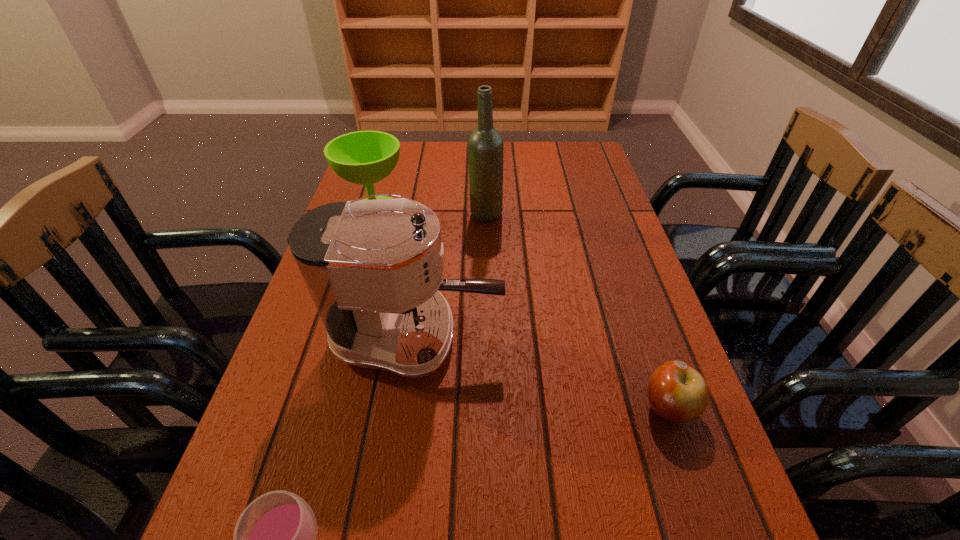
Identify the location of wineglass that is at the left edge. This screenshot has height=540, width=960. (364, 157).

Identify the location of object that is positioned at the right edge. The image size is (960, 540). (677, 392).

Where is `vacant space at the far edge of the desktop`? The image size is (960, 540). vacant space at the far edge of the desktop is located at coordinates (457, 147).

I want to click on vacant space at the left edge of the desktop, so click(294, 442).

Image resolution: width=960 pixels, height=540 pixels. I want to click on vacant space at the right edge of the desktop, so click(x=711, y=443).

This screenshot has width=960, height=540. Find the location of `vacant region between the wine bottle and the coffee maker`. vacant region between the wine bottle and the coffee maker is located at coordinates (450, 276).

This screenshot has width=960, height=540. What are the coordinates of `vacant point located between the wine bottle and the shortest object` in the screenshot? It's located at (577, 311).

Find the location of a particular element. The height and width of the screenshot is (540, 960). vacant region between the coffee maker and the wine bottle is located at coordinates (450, 276).

Locate an element on the screen. Image resolution: width=960 pixels, height=540 pixels. free space between the wine bottle and the shortest object is located at coordinates (577, 311).

Identify the location of object identified as the fourth closest to the coffee maker. (485, 145).